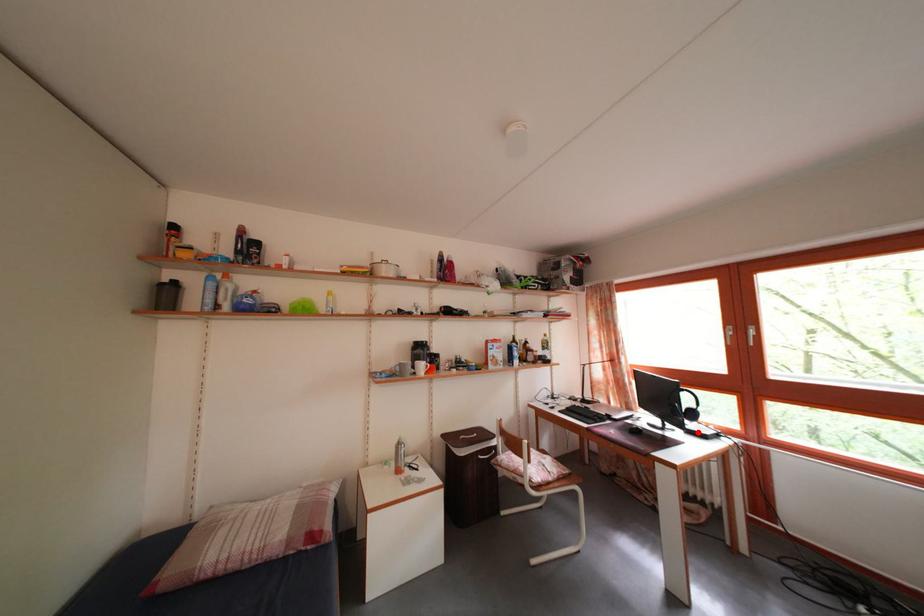
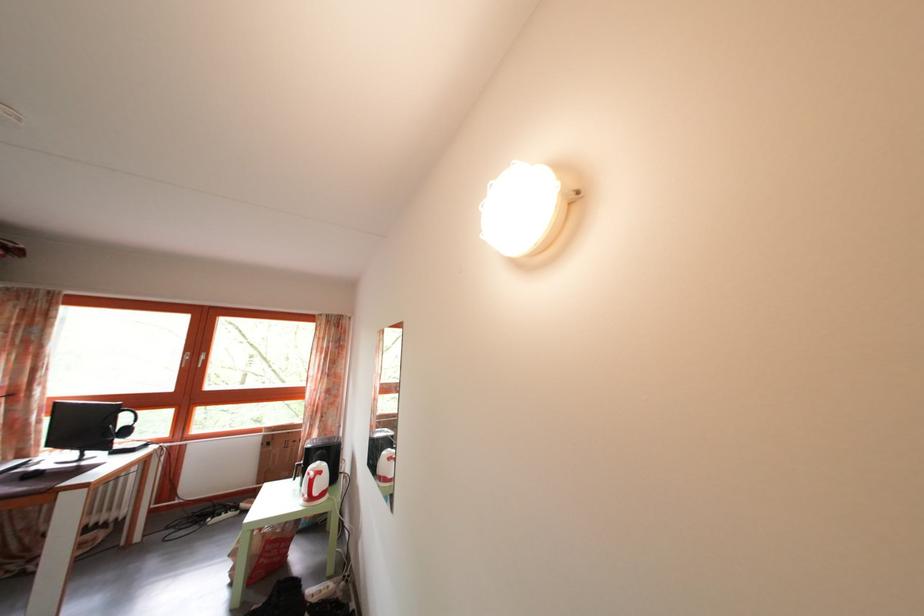
Question: I am providing you with two images of the same scene from different viewpoints. In image1, a red point is highlighted. Considering the same 3D point in image2, which of the following is correct?

Choices:
 (A) It is closer
 (B) It is farther

Answer: (A)